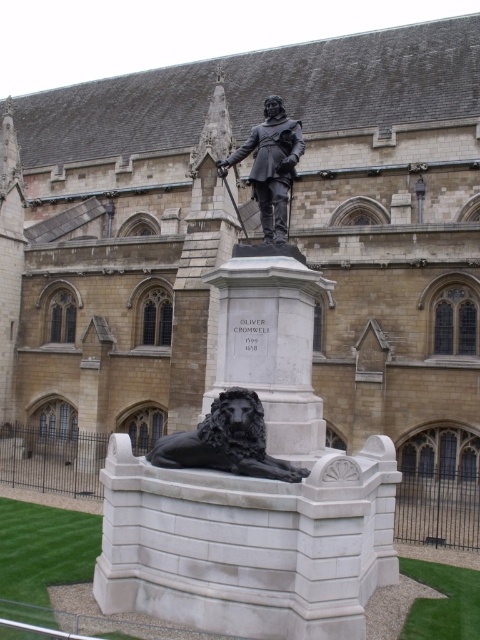
Who is positioned more to the right, black polished stone lion at lower center or bronze statue at center?

bronze statue at center

Can you confirm if black polished stone lion at lower center is taller than bronze statue at center?

No, black polished stone lion at lower center is not taller than bronze statue at center.

Where is `black polished stone lion at lower center`? black polished stone lion at lower center is located at coordinates (227, 442).

Who is positioned more to the left, black polished stone statue at center or black polished stone lion at lower center?

Positioned to the left is black polished stone lion at lower center.

Between black polished stone statue at center and black polished stone lion at lower center, which one has more height?

black polished stone statue at center is taller.

Which is in front, point (389, 460) or point (157, 452)?

Positioned in front is point (157, 452).

This screenshot has width=480, height=640. What are the coordinates of `black polished stone statue at center` in the screenshot? It's located at (252, 484).

Can you confirm if black polished stone statue at center is bigger than bronze statue at center?

Incorrect, black polished stone statue at center is not larger than bronze statue at center.

Does black polished stone statue at center appear under bronze statue at center?

Yes.

Looking at this image, who is more forward, (348, 632) or (284, 124)?

Positioned in front is point (348, 632).

The width and height of the screenshot is (480, 640). In order to click on black polished stone statue at center in this screenshot , I will do `click(252, 484)`.